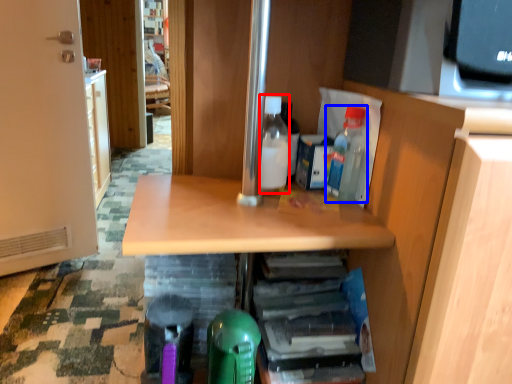
Question: Which object is further to the camera taking this photo, bottle (highlighted by a red box) or bottle (highlighted by a blue box)?

Choices:
 (A) bottle
 (B) bottle

Answer: (A)